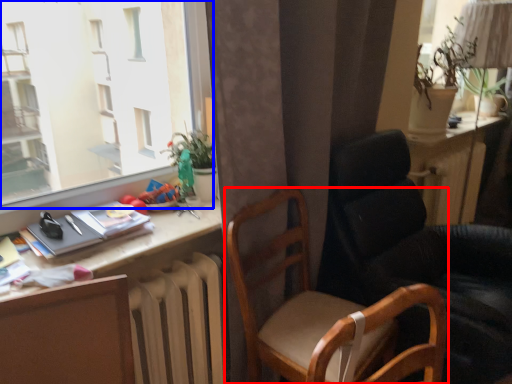
Question: Which of the following is the farthest to the observer, chair (highlighted by a red box) or window (highlighted by a blue box)?

Choices:
 (A) chair
 (B) window

Answer: (A)